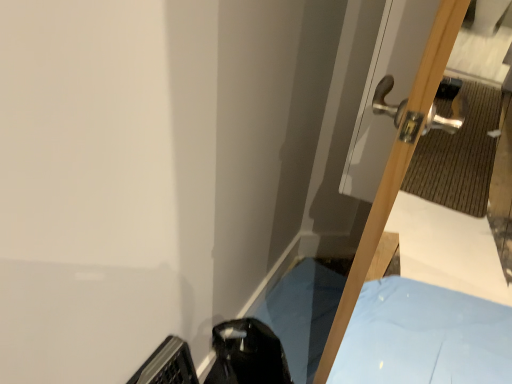
Identify the location of free point to the left of metallic silver door at upper right. The width and height of the screenshot is (512, 384). (291, 310).